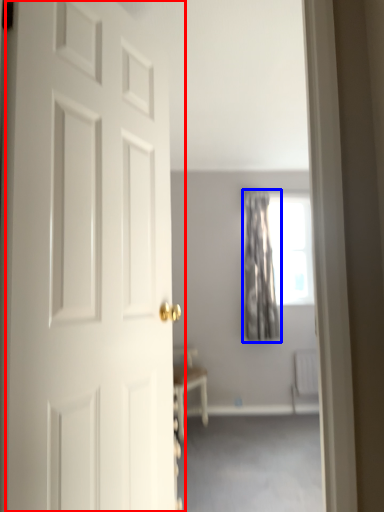
Question: Which of the following is the farthest to the observer, door (highlighted by a red box) or curtain (highlighted by a blue box)?

Choices:
 (A) door
 (B) curtain

Answer: (B)